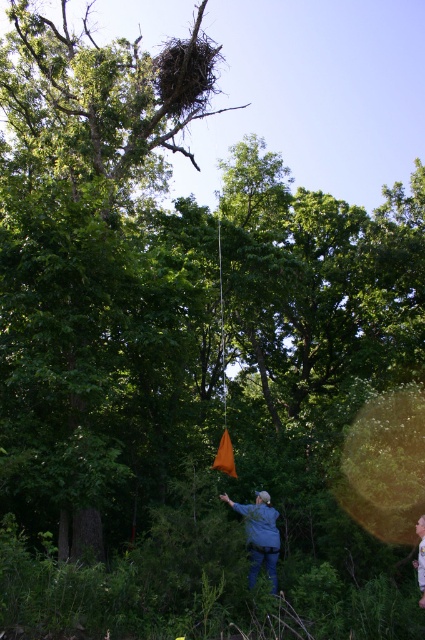
Can you confirm if green leafy tree at upper center is positioned to the right of blue denim jacket at center?

No, green leafy tree at upper center is not to the right of blue denim jacket at center.

Image resolution: width=425 pixels, height=640 pixels. What are the coordinates of `green leafy tree at upper center` in the screenshot? It's located at (93, 259).

Is point (268, 554) farther from camera compared to point (421, 580)?

Yes.

Who is positioned more to the right, blue denim jacket at center or blue denim jeans at lower center?

blue denim jeans at lower center is more to the right.

Measure the distance between blue denim jacket at center and camera.

blue denim jacket at center is 30.10 feet away from camera.

Image resolution: width=425 pixels, height=640 pixels. I want to click on blue denim jacket at center, so click(260, 536).

Can you confirm if green leafy tree at upper center is positioned to the left of blue denim jeans at lower center?

Indeed, green leafy tree at upper center is positioned on the left side of blue denim jeans at lower center.

Is green leafy tree at upper center thinner than blue denim jeans at lower center?

In fact, green leafy tree at upper center might be wider than blue denim jeans at lower center.

Is point (14, 262) in front of point (419, 525)?

No, it is not.

Find the location of a particular element. green leafy tree at upper center is located at coordinates (93, 259).